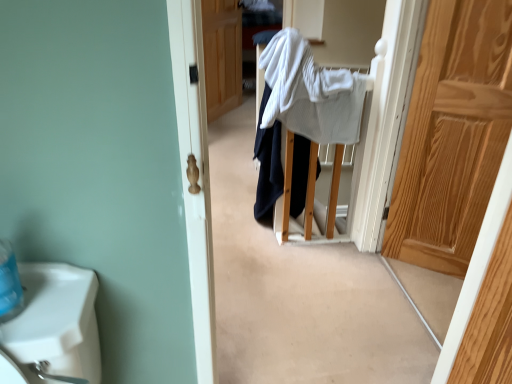
Question: In terms of height, does white textured bath towel at center look taller or shorter compared to wooden door at center, the first door positioned from the left?

Choices:
 (A) short
 (B) tall

Answer: (A)

Question: Is point (280, 36) closer or farther from the camera than point (239, 61)?

Choices:
 (A) closer
 (B) farther

Answer: (A)

Question: Which object is positioned closest to the wooden door at center, positioned as the second door in bottom-to-top order?

Choices:
 (A) white cotton sweater at center
 (B) light brown wooden door at right, which appears as the 1th door when ordered from the bottom
 (C) white textured bath towel at center

Answer: (A)

Question: Estimate the real-world distances between objects in this image. Which object is closer to the wooden door at center, positioned as the second door in bottom-to-top order?

Choices:
 (A) white textured bath towel at center
 (B) white cotton sweater at center
 (C) light brown wooden door at right, which is the 2th door in top-to-bottom order

Answer: (B)